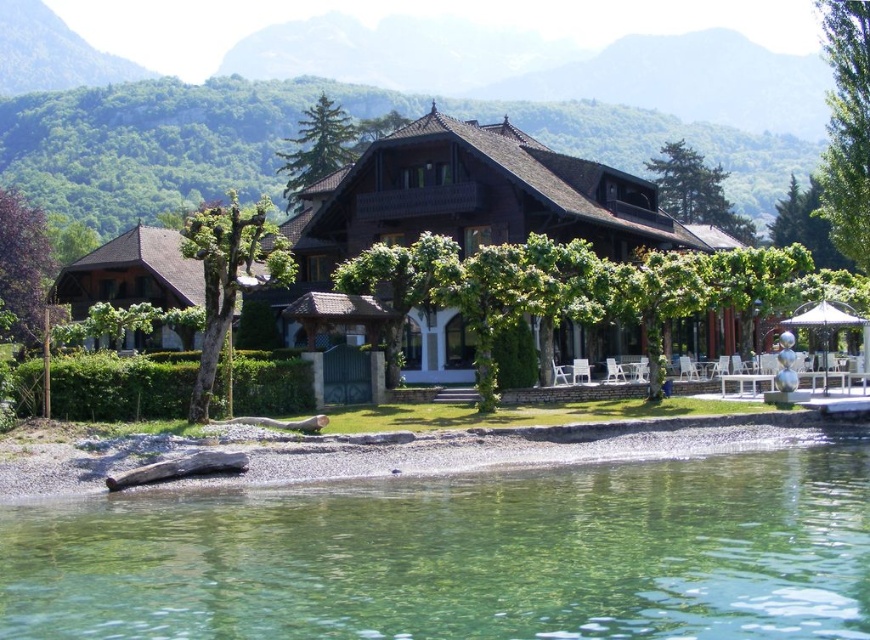
Who is lower down, clear water at lower center or smooth gravel shore at lower left?

clear water at lower center is below.

Who is shorter, clear water at lower center or smooth gravel shore at lower left?

With less height is smooth gravel shore at lower left.

Describe the element at coordinates (463, 556) in the screenshot. Image resolution: width=870 pixels, height=640 pixels. I see `clear water at lower center` at that location.

Locate an element on the screen. clear water at lower center is located at coordinates (463, 556).

Measure the distance from brown wooden gazebo at center to smooth gravel shore at lower left.

A distance of 102.46 feet exists between brown wooden gazebo at center and smooth gravel shore at lower left.

Is point (373, 164) farther from viewer compared to point (402, 467)?

Yes, point (373, 164) is behind point (402, 467).

Between point (537, 141) and point (353, 461), which one is positioned behind?

Positioned behind is point (537, 141).

Find the location of a particular element. This screenshot has width=870, height=640. brown wooden gazebo at center is located at coordinates (472, 198).

Does clear water at lower center lie in front of brown wooden gazebo at center?

Yes, it is in front of brown wooden gazebo at center.

Who is higher up, clear water at lower center or brown wooden gazebo at center?

brown wooden gazebo at center is above.

Which is behind, point (239, 499) or point (452, 192)?

The point (452, 192) is more distant.

Where is `clear water at lower center`? clear water at lower center is located at coordinates (463, 556).